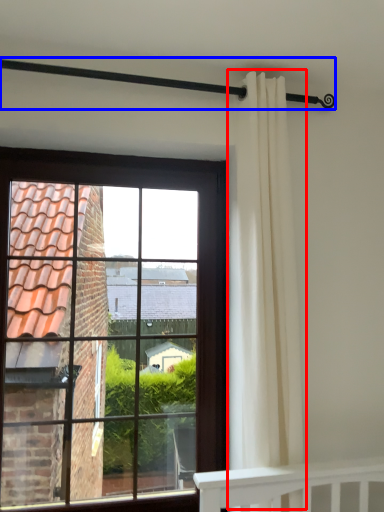
Question: Which point is further to the camera, curtain (highlighted by a red box) or balustrade (highlighted by a blue box)?

Choices:
 (A) curtain
 (B) balustrade

Answer: (A)